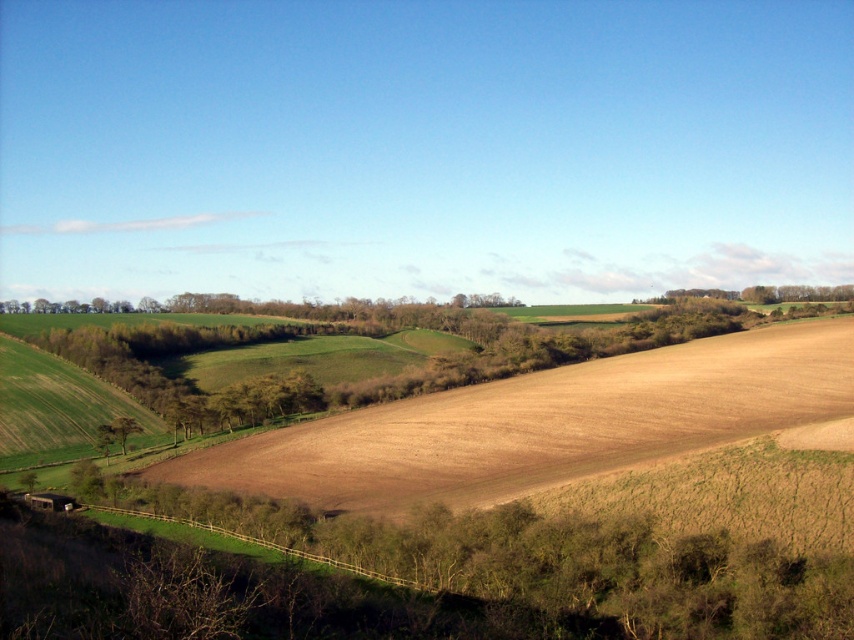
From the picture: Is brown soil at lower left positioned before green leafy tree at lower left?

Yes, it is.

In order to click on brown soil at lower left in this screenshot , I will do `click(541, 422)`.